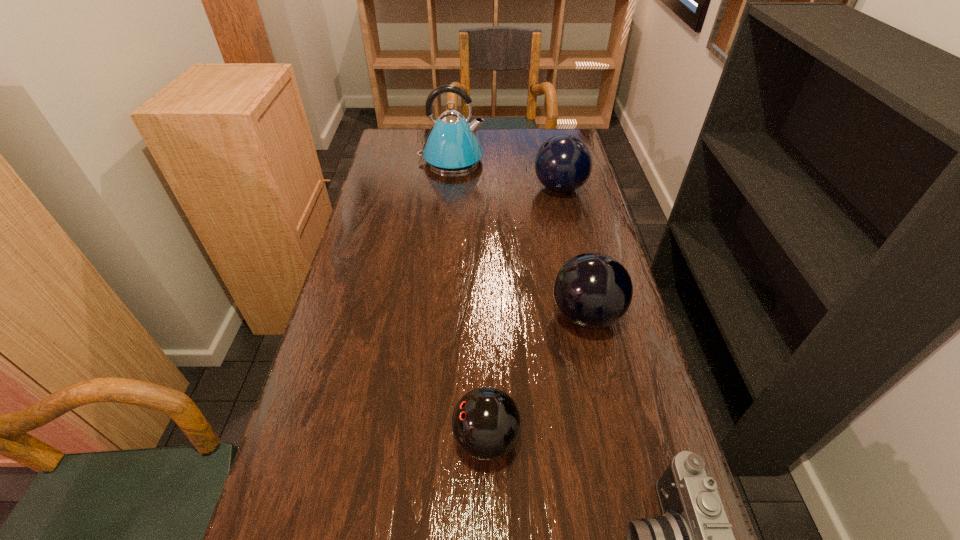
Find the location of a particular element. The height and width of the screenshot is (540, 960). blank space located 0.060m on the side of the third nearest object with the finger holes is located at coordinates (526, 315).

The width and height of the screenshot is (960, 540). Identify the location of vacant space situated on the side of the third nearest object with the finger holes. (400, 315).

Locate an element on the screen. vacant space situated on the surface of the shortest bowling ball near the finger holes is located at coordinates (354, 439).

Identify the location of free space located 0.270m on the surface of the shortest bowling ball near the finger holes. (320, 439).

Find the location of a particular element. vacant space located 0.320m on the surface of the shortest bowling ball near the finger holes is located at coordinates (295, 439).

Locate an element on the screen. object positioned at the far edge is located at coordinates (452, 146).

At what (x,y) coordinates should I click in order to perform the action: click on object present at the left edge. Please return your answer as a coordinate pair (x, y). Looking at the image, I should click on (452, 146).

You are a GUI agent. You are given a task and a screenshot of the screen. Output one action in this format:
    pyautogui.click(x=<x>, y=<y>)
    Task: Click on the object at the far left corner
    
    Given the screenshot: What is the action you would take?
    pyautogui.click(x=452, y=146)

Find the location of a particular element. This screenshot has height=540, width=960. vacant region at the left edge is located at coordinates (360, 225).

The height and width of the screenshot is (540, 960). What are the coordinates of `free region at the right edge of the desktop` in the screenshot? It's located at (616, 346).